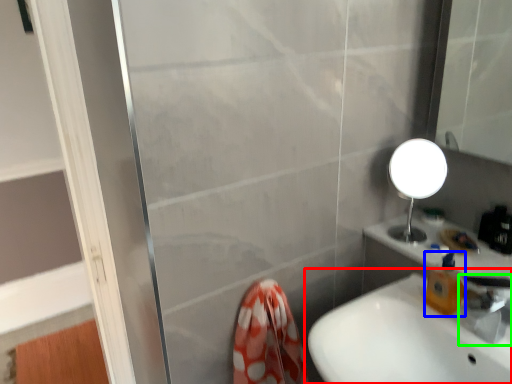
Question: Which object is the farthest from sink (highlighted by a red box)? Choose among these: soap dispenser (highlighted by a blue box) or tap (highlighted by a green box).

Choices:
 (A) soap dispenser
 (B) tap

Answer: (B)